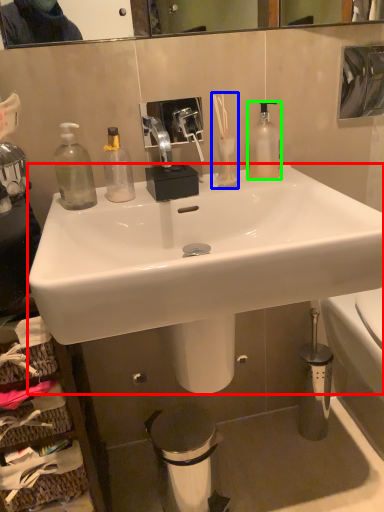
Question: Considering the real-world distances, which object is closest to sink (highlighted by a red box)? toiletry (highlighted by a blue box) or bottle (highlighted by a green box).

Choices:
 (A) toiletry
 (B) bottle

Answer: (A)